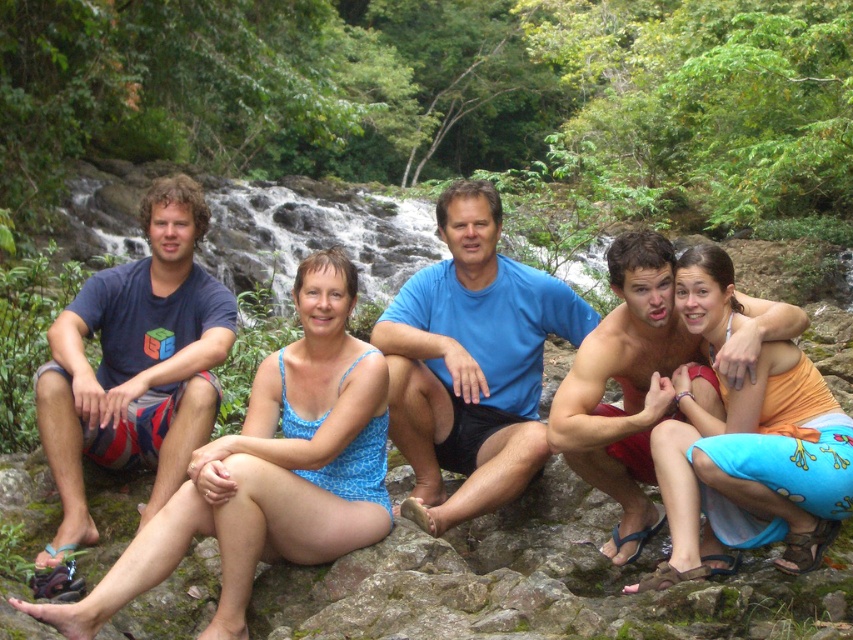
Question: From the image, what is the correct spatial relationship of blue fabric swimsuit at center in relation to dark blue t-shirt at left?

Choices:
 (A) left
 (B) right

Answer: (B)

Question: Can you confirm if blue printed swimsuit at center is positioned below blue fabric swimsuit at center?

Choices:
 (A) yes
 (B) no

Answer: (B)

Question: Can you confirm if blue fabric swimsuit at center is positioned to the right of orange cotton dress at center?

Choices:
 (A) yes
 (B) no

Answer: (B)

Question: Based on their relative distances, which object is nearer to the dark blue t-shirt at left?

Choices:
 (A) blue t-shirt at center
 (B) blue printed swimsuit at center
 (C) orange cotton dress at center
 (D) blue fabric swimsuit at center

Answer: (B)

Question: Which of these objects is positioned farthest from the dark blue t-shirt at left?

Choices:
 (A) blue fabric swimsuit at center
 (B) blue t-shirt at center

Answer: (B)

Question: Estimate the real-world distances between objects in this image. Which object is farther from the blue fabric swimsuit at center?

Choices:
 (A) orange cotton dress at center
 (B) blue t-shirt at center

Answer: (A)